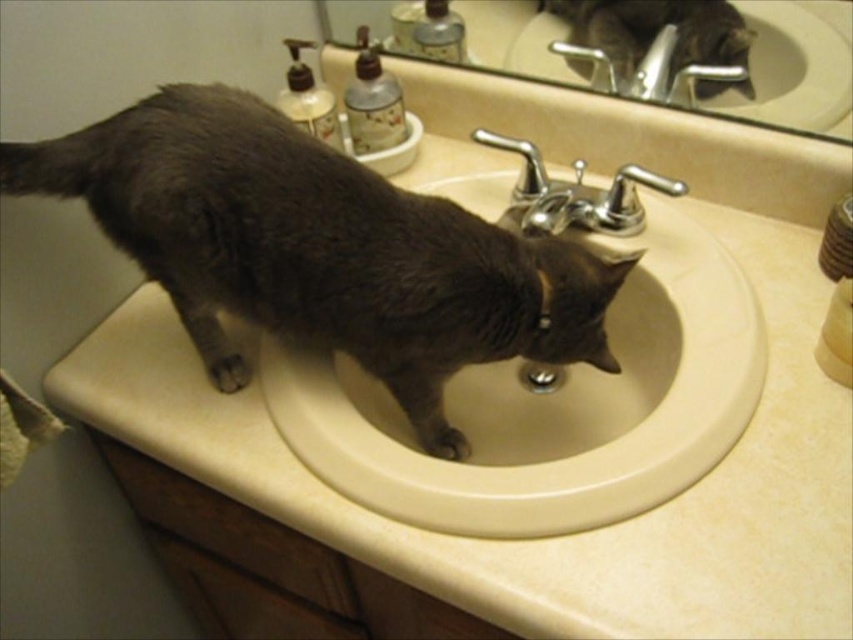
You are a photographer trying to capture a clear image of the beige ceramic sink at center and the gray fur cat at sink center. Since you want the sink to be the main focus, which object should you adjust your camera to prioritize in terms of depth of field?

The beige ceramic sink at center is closer to the viewer than the gray fur cat at sink center, so to prioritize the sink in the depth of field, adjust the camera focus on the beige ceramic sink at center.

You are a cat owner who wants to ensure your cat stays safe in the bathroom. The cat is currently at point (x=318, y=248). Which object from the list below is the cat near? Choose the correct label from the objects in the scene. Objects in scene are dark gray fur at sink, pump dispenser liquid soap, flip top lotion bottle, and small white dish with bottles.

The cat is near the dark gray fur at sink, as point (x=318, y=248) indicates the location of the dark gray fur at sink.